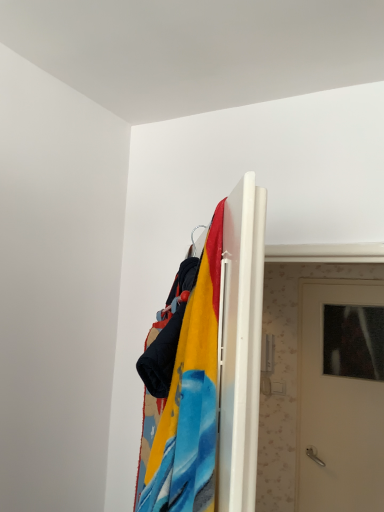
Question: Should I look upward or downward to see velvet fabric blanket at upper center?

Choices:
 (A) down
 (B) up

Answer: (A)

Question: Can you confirm if velvet fabric blanket at upper center is taller than white matte door at center?

Choices:
 (A) no
 (B) yes

Answer: (A)

Question: Is velvet fabric blanket at upper center facing towards white matte door at center?

Choices:
 (A) yes
 (B) no

Answer: (B)

Question: Does velvet fabric blanket at upper center touch white matte door at center?

Choices:
 (A) yes
 (B) no

Answer: (B)

Question: Is velvet fabric blanket at upper center wider than white matte door at center?

Choices:
 (A) yes
 (B) no

Answer: (B)

Question: Can you confirm if velvet fabric blanket at upper center is bigger than white matte door at center?

Choices:
 (A) no
 (B) yes

Answer: (A)

Question: Can you confirm if velvet fabric blanket at upper center is smaller than white matte door at center?

Choices:
 (A) yes
 (B) no

Answer: (A)

Question: Can you confirm if white matte door at center is bigger than velvet fabric blanket at upper center?

Choices:
 (A) yes
 (B) no

Answer: (A)

Question: Is the position of white matte door at center less distant than that of velvet fabric blanket at upper center?

Choices:
 (A) no
 (B) yes

Answer: (A)

Question: Is white matte door at center completely or partially outside of velvet fabric blanket at upper center?

Choices:
 (A) yes
 (B) no

Answer: (A)

Question: Does white matte door at center contain velvet fabric blanket at upper center?

Choices:
 (A) yes
 (B) no

Answer: (B)

Question: Does white matte door at center have a lesser height compared to velvet fabric blanket at upper center?

Choices:
 (A) yes
 (B) no

Answer: (B)

Question: From a real-world perspective, is white matte door at center on velvet fabric blanket at upper center?

Choices:
 (A) yes
 (B) no

Answer: (B)

Question: From the image's perspective, is velvet fabric blanket at upper center positioned above or below white matte door at center?

Choices:
 (A) above
 (B) below

Answer: (A)